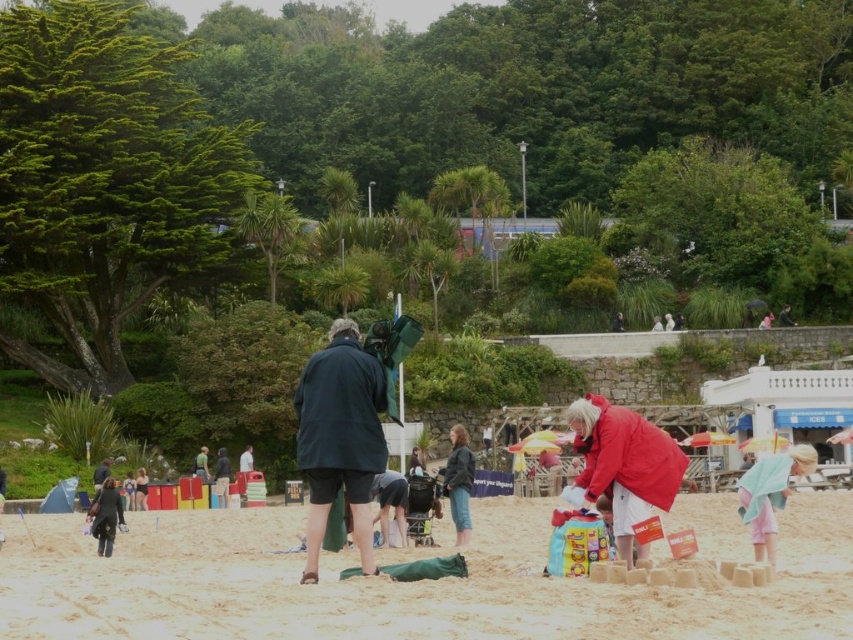
Can you confirm if dark green fabric at center is wider than pink cotton towel at lower right?

No, dark green fabric at center is not wider than pink cotton towel at lower right.

Is point (352, 330) farther from viewer compared to point (776, 525)?

No, it is not.

Is point (354, 515) positioned after point (770, 515)?

That is False.

Where is `dark green fabric at center`? The image size is (853, 640). dark green fabric at center is located at coordinates (340, 436).

Is red matte jacket at center below dark gray fabric bag at lower left?

No, red matte jacket at center is not below dark gray fabric bag at lower left.

Between red matte jacket at center and dark gray fabric bag at lower left, which one has more height?

A: Standing taller between the two is red matte jacket at center.

From the picture: Measure the distance between point (x=578, y=481) and camera.

Point (x=578, y=481) and camera are 117.55 feet apart.

You are a GUI agent. You are given a task and a screenshot of the screen. Output one action in this format:
    pyautogui.click(x=<x>, y=<y>)
    Task: Click on the red matte jacket at center
    
    Given the screenshot: What is the action you would take?
    pyautogui.click(x=624, y=464)

Is leather jacket at center taller than dark gray fabric bag at lower left?

Correct, leather jacket at center is much taller as dark gray fabric bag at lower left.

Can you confirm if leather jacket at center is positioned to the left of dark gray fabric bag at lower left?

Incorrect, leather jacket at center is not on the left side of dark gray fabric bag at lower left.

Find the location of a particular element. leather jacket at center is located at coordinates (457, 483).